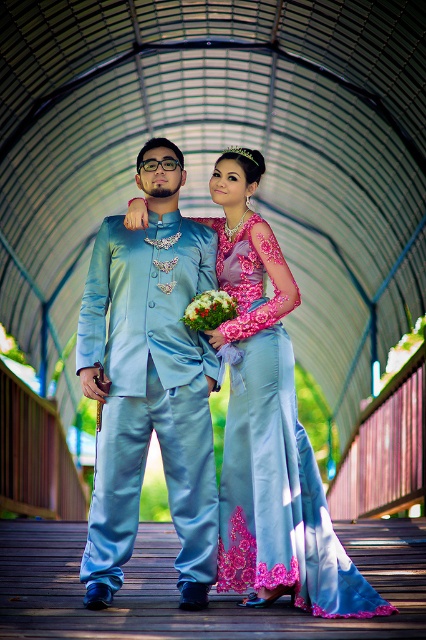
Based on the photo, does silky pink dress at center appear on the left side of green floral bouquet at center?

No, silky pink dress at center is not to the left of green floral bouquet at center.

Is silky pink dress at center shorter than green floral bouquet at center?

No.

Identify the location of silky pink dress at center. Image resolution: width=426 pixels, height=640 pixels. (273, 456).

Does satin blue suit at center have a greater width compared to silky pink dress at center?

Yes, satin blue suit at center is wider than silky pink dress at center.

Between satin blue suit at center and silky pink dress at center, which one is positioned lower?

silky pink dress at center

Describe the element at coordinates (229, 404) in the screenshot. I see `satin blue suit at center` at that location.

The width and height of the screenshot is (426, 640). In order to click on satin blue suit at center in this screenshot , I will do `click(229, 404)`.

Describe the element at coordinates (149, 381) in the screenshot. Image resolution: width=426 pixels, height=640 pixels. I see `satin light blue suit at center` at that location.

Does satin light blue suit at center have a smaller size compared to green floral bouquet at center?

No.

Between point (126, 316) and point (213, 314), which one is positioned behind?

Positioned behind is point (213, 314).

The width and height of the screenshot is (426, 640). Find the location of `satin light blue suit at center`. satin light blue suit at center is located at coordinates (149, 381).